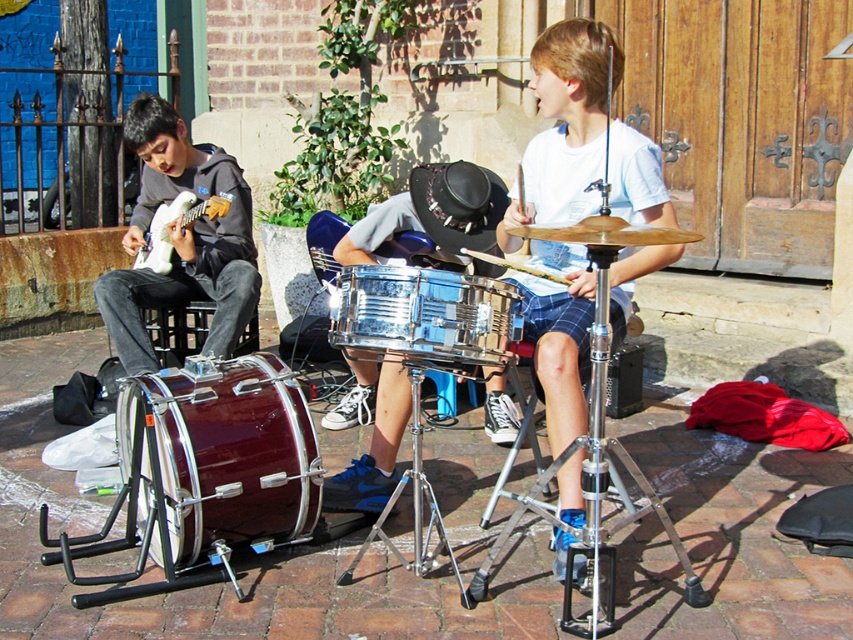
Who is shorter, white matte drum at center or clear plastic drum at center?

clear plastic drum at center

Is point (576, 412) positioned in front of point (430, 310)?

No, (576, 412) is further to viewer.

Identify the location of white matte drum at center. The height and width of the screenshot is (640, 853). (566, 125).

Can you confirm if maroon polished drum at lower left is shorter than clear plastic drum at center?

No.

Measure the distance between point (x=248, y=385) and camera.

Point (x=248, y=385) is 3.29 meters from camera.

Between point (286, 397) and point (374, 304), which one is positioned in front?

Point (374, 304) is more forward.

This screenshot has width=853, height=640. I want to click on maroon polished drum at lower left, so click(225, 451).

Can you confirm if white matte drum at center is taller than maroon polished drum at lower left?

Indeed, white matte drum at center has a greater height compared to maroon polished drum at lower left.

The image size is (853, 640). Describe the element at coordinates (566, 125) in the screenshot. I see `white matte drum at center` at that location.

Which is in front, point (553, 561) or point (296, 410)?

Point (553, 561) is in front.

Where is `white matte drum at center`? white matte drum at center is located at coordinates (566, 125).